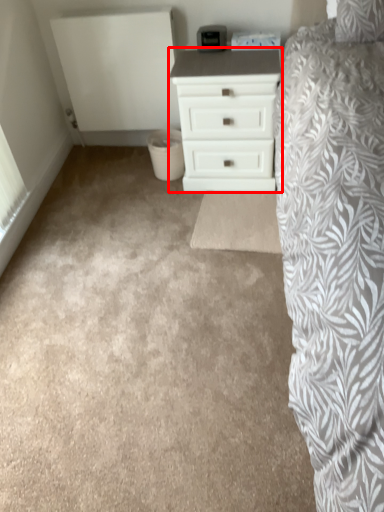
Question: Considering the relative positions of chest of drawers (annotated by the red box) and plain in the image provided, where is chest of drawers (annotated by the red box) located with respect to the staircase?

Choices:
 (A) left
 (B) right

Answer: (B)